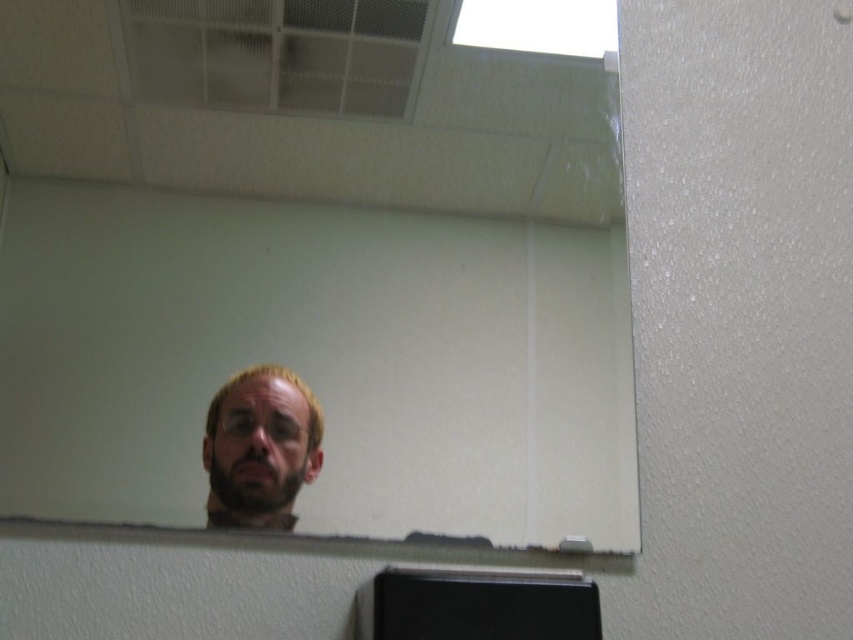
You are standing in an office and see the clear glass mirror at center and the light brown hair at center. Which object is closer to you?

The clear glass mirror at center is closer to you because it is in front of the light brown hair at center.

You are standing in an office and want to place a small plant exactly at the center of the clear glass mirror at center. According to the coordinates provided, where should you place the plant?

The clear glass mirror at center is located at point (311, 273), so you should place the plant at those coordinates to be at the center of the mirror.

You are a person standing in front of the clear glass mirror at center. You want to adjust your light brown hair at center so that it is no longer visible in the mirror. Can you move your head back enough to achieve this?

The distance between the clear glass mirror at center and light brown hair at center is 8.34 inches. To prevent the hair from appearing in the mirror, you would need to move your head back beyond this distance. Since you are currently at that exact distance, moving back slightly should help achieve the desired result.